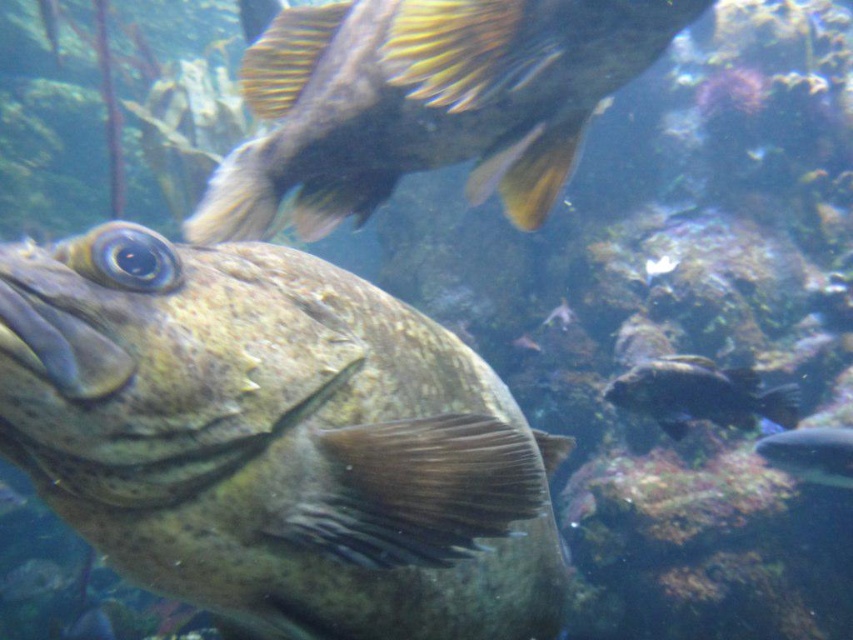
You are a marine biologist studying underwater life. You notice a point at coordinates (424,102) in the image. Based on the scene described, what creature is located at that point?

The point at coordinates (424,102) corresponds to the shiny black fish at upper center.

You are a marine biologist studying underwater life. You observe a point at coordinates (276, 440) in the image. What does this point represent?

The point at coordinates (276, 440) represents the speckled brown fish at center.